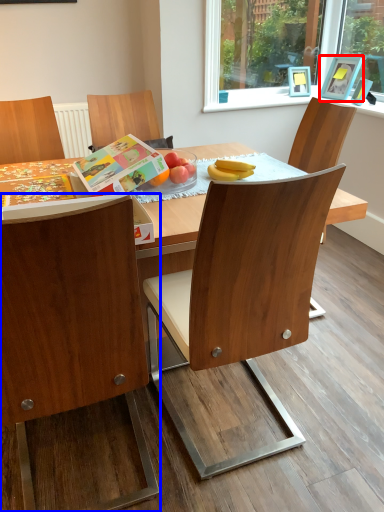
Question: Which point is further to the camera, picture frame (highlighted by a red box) or chair (highlighted by a blue box)?

Choices:
 (A) picture frame
 (B) chair

Answer: (A)